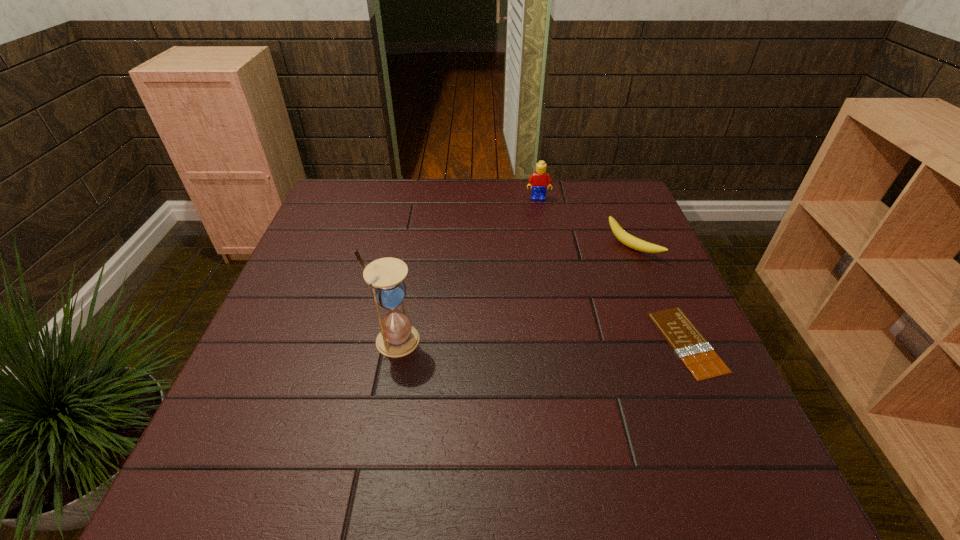
The height and width of the screenshot is (540, 960). What are the coordinates of `free space located on the front-facing side of the Lego` in the screenshot? It's located at (540, 253).

You are a GUI agent. You are given a task and a screenshot of the screen. Output one action in this format:
    pyautogui.click(x=<x>, y=<y>)
    Task: Click on the vacant space located on the front-facing side of the Lego
    The width and height of the screenshot is (960, 540).
    Given the screenshot: What is the action you would take?
    pyautogui.click(x=540, y=225)

Identify the location of free point located on the upward curve of the second shortest object. The image size is (960, 540). (586, 282).

Find the location of `free space located 0.360m on the upward curve of the second shortest object`. free space located 0.360m on the upward curve of the second shortest object is located at coordinates (523, 326).

At what (x,y) coordinates should I click in order to perform the action: click on blank area located on the upward curve of the second shortest object. Please return your answer as a coordinate pair (x, y). Looking at the image, I should click on (600, 272).

Locate an element on the screen. Image resolution: width=960 pixels, height=540 pixels. object located in the far edge section of the desktop is located at coordinates (539, 180).

Locate an element on the screen. chocolate bar that is at the right edge is located at coordinates (689, 344).

Where is `banana located in the right edge section of the desktop`? banana located in the right edge section of the desktop is located at coordinates (627, 239).

This screenshot has height=540, width=960. Find the location of `vacant space at the far edge of the desktop`. vacant space at the far edge of the desktop is located at coordinates (396, 198).

Where is `vacant space at the near edge of the desktop`? vacant space at the near edge of the desktop is located at coordinates (444, 409).